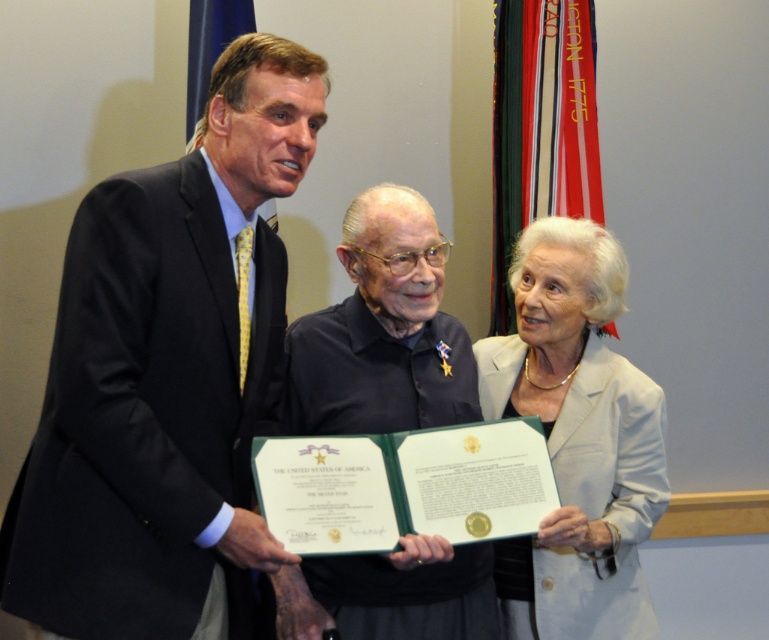
Question: Based on their relative distances, which object is farther from the black matte shirt at center?

Choices:
 (A) dark suit at center
 (B) light beige fabric at center

Answer: (A)

Question: Which point appears farthest from the camera in this image?

Choices:
 (A) (288, 612)
 (B) (202, 161)
 (C) (558, 445)

Answer: (C)

Question: From the image, what is the correct spatial relationship of light beige fabric at center in relation to black matte shirt at center?

Choices:
 (A) right
 (B) left

Answer: (A)

Question: Is light beige fabric at center above black matte shirt at center?

Choices:
 (A) no
 (B) yes

Answer: (A)

Question: Based on their relative distances, which object is farther from the light beige fabric at center?

Choices:
 (A) black matte shirt at center
 (B) dark suit at center

Answer: (B)

Question: Is dark suit at center closer to camera compared to light beige fabric at center?

Choices:
 (A) no
 (B) yes

Answer: (B)